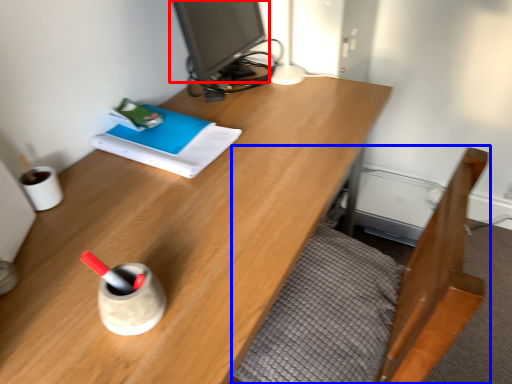
Question: Among these objects, which one is farthest to the camera, computer monitor (highlighted by a red box) or bed frame (highlighted by a blue box)?

Choices:
 (A) computer monitor
 (B) bed frame

Answer: (A)